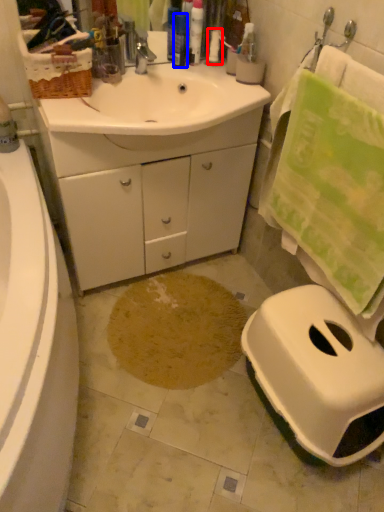
Question: Which of the following is the farthest to the observer, toiletry (highlighted by a red box) or toiletry (highlighted by a blue box)?

Choices:
 (A) toiletry
 (B) toiletry

Answer: (A)